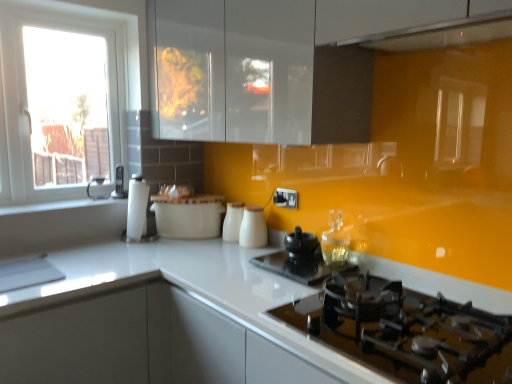
Where is `space that is in front of matte black kettle at left, marked as the third appliance in a right-to-left arrangement`? This screenshot has width=512, height=384. space that is in front of matte black kettle at left, marked as the third appliance in a right-to-left arrangement is located at coordinates (106, 197).